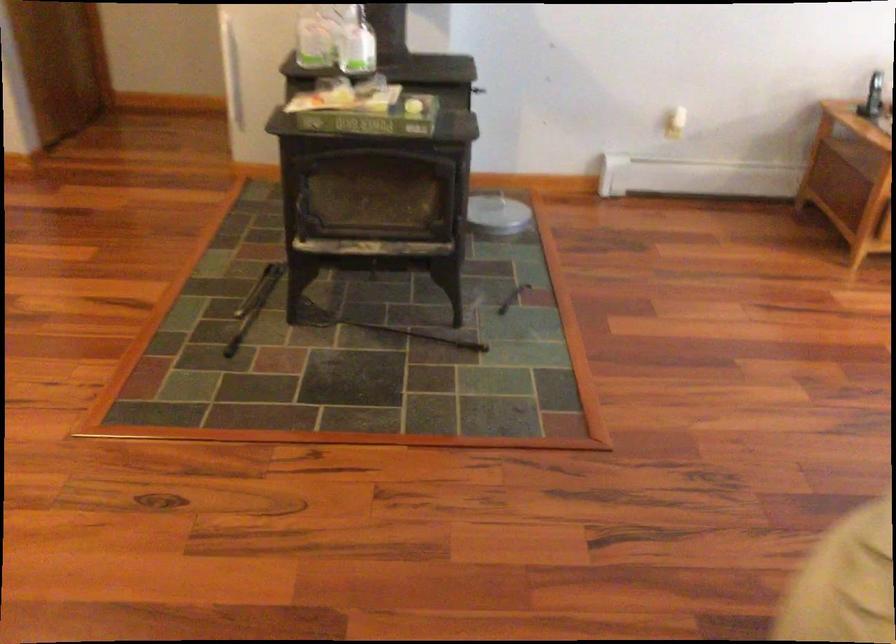
What do you see at coordinates (453, 199) in the screenshot? This screenshot has width=896, height=644. I see `a stove door handle` at bounding box center [453, 199].